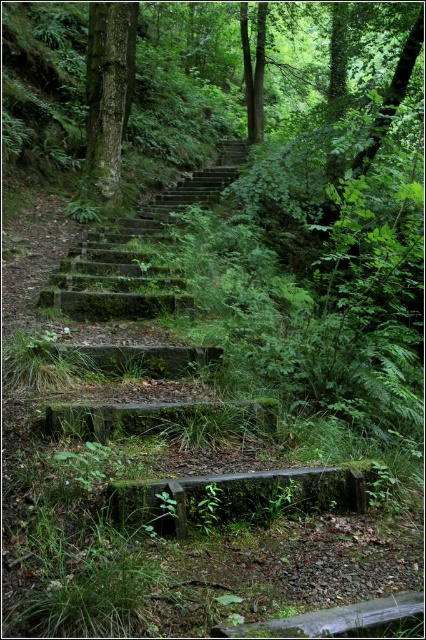
This screenshot has width=426, height=640. Identify the location of mossy concrete stairs at center. (135, 253).

Between point (166, 214) and point (129, 77), which one is positioned behind?

The point (129, 77) is more distant.

This screenshot has height=640, width=426. I want to click on mossy concrete stairs at center, so point(135,253).

Who is higher up, green mossy wood at lower center or green mossy tree trunk at upper left?

green mossy tree trunk at upper left is above.

Who is more forward, [155,496] or [94,12]?

Point [155,496] is in front.

Where is `green mossy wood at lower center`? The image size is (426, 640). green mossy wood at lower center is located at coordinates (235, 497).

Can you confirm if mossy concrete stairs at center is shorter than green mossy wood at lower center?

Yes, mossy concrete stairs at center is shorter than green mossy wood at lower center.

Which is in front, point (118, 276) or point (319, 474)?

Point (319, 474)

At what (x,y) coordinates should I click in order to perform the action: click on mossy concrete stairs at center. Please return your answer as a coordinate pair (x, y). The width and height of the screenshot is (426, 640). Looking at the image, I should click on (135, 253).